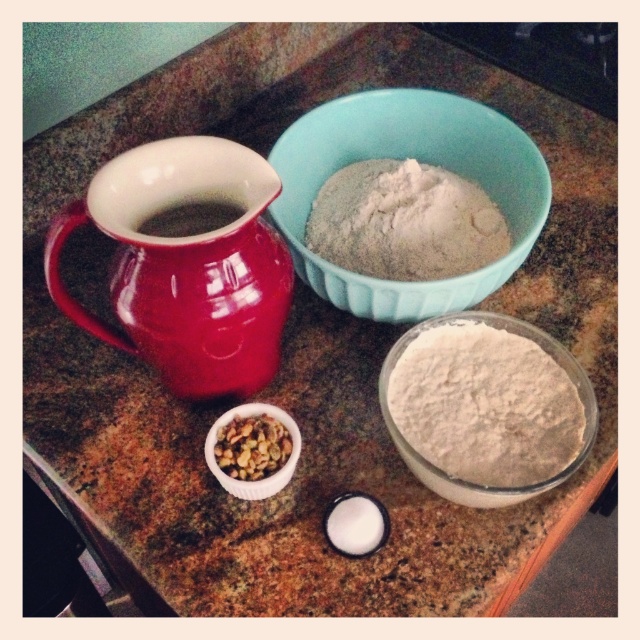
Between matte ceramic jug at left and blue ceramic bowl at upper center, which one has less height?

Standing shorter between the two is matte ceramic jug at left.

Between matte ceramic jug at left and blue ceramic bowl at upper center, which one appears on the left side from the viewer's perspective?

matte ceramic jug at left

Is point (184, 184) in front of point (308, 260)?

Yes, it is in front of point (308, 260).

What are the coordinates of `matte ceramic jug at left` in the screenshot? It's located at (186, 262).

Is matte ceramic jug at left closer to the viewer compared to brown textured nuts at center?

Yes.

Is matte ceramic jug at left wider than brown textured nuts at center?

Indeed, matte ceramic jug at left has a greater width compared to brown textured nuts at center.

Find the location of a particular element. The width and height of the screenshot is (640, 640). matte ceramic jug at left is located at coordinates (186, 262).

Is white powdery flour at center further to the viewer compared to brown textured nuts at center?

No, white powdery flour at center is in front of brown textured nuts at center.

Who is more distant from viewer, [483,358] or [237,432]?

The point [483,358] is more distant.

Locate an element on the screen. The image size is (640, 640). white powdery flour at center is located at coordinates (486, 404).